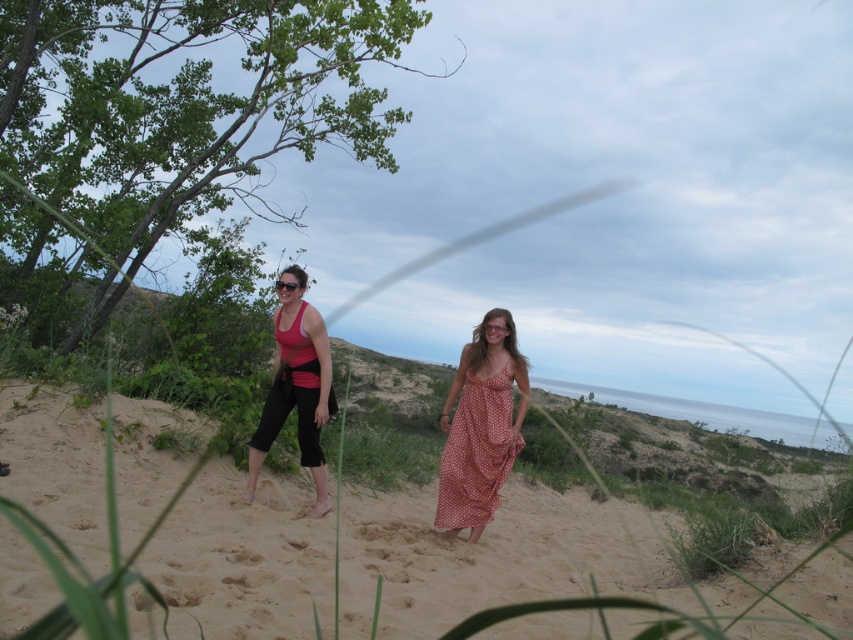
Question: Which object is the closest to the transparent plastic goggles at center?

Choices:
 (A) polka dot fabric dress at center
 (B) matte pink tank top at center

Answer: (A)

Question: Which of the following is the closest to the observer?

Choices:
 (A) click(x=252, y=490)
 (B) click(x=496, y=321)
 (C) click(x=451, y=468)

Answer: (B)

Question: Is the position of matte pink tank top at center more distant than that of polka dot fabric dress at center?

Choices:
 (A) no
 (B) yes

Answer: (A)

Question: Can you confirm if beige sandy beach at center is wider than transparent plastic goggles at center?

Choices:
 (A) no
 (B) yes

Answer: (B)

Question: Does polka dot fabric dress at center lie in front of matte black sunglasses at center?

Choices:
 (A) no
 (B) yes

Answer: (A)

Question: Considering the real-world distances, which object is closest to the transparent plastic goggles at center?

Choices:
 (A) beige sandy beach at center
 (B) matte pink tank top at center
 (C) matte black sunglasses at center

Answer: (C)